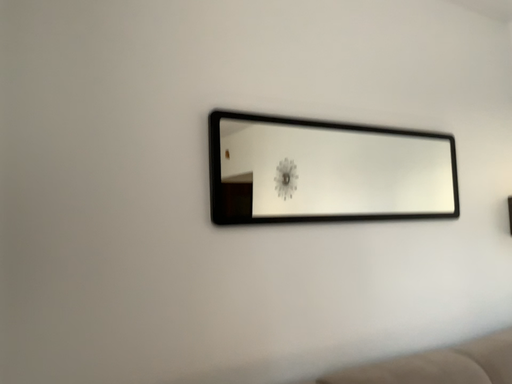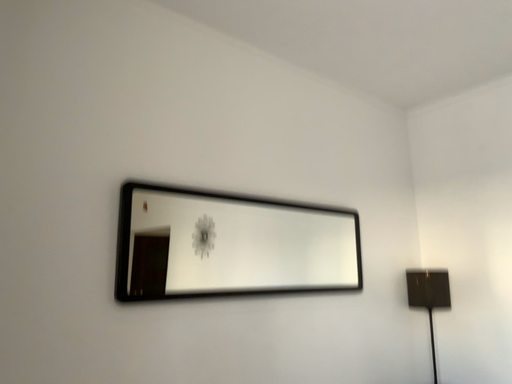
Question: How did the camera likely rotate when shooting the video?

Choices:
 (A) rotated upward
 (B) rotated downward

Answer: (A)